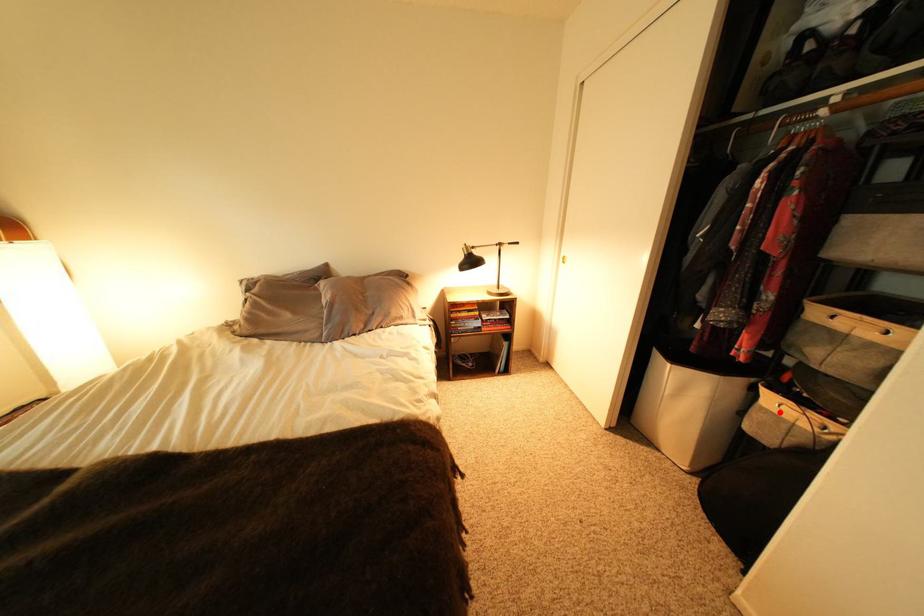
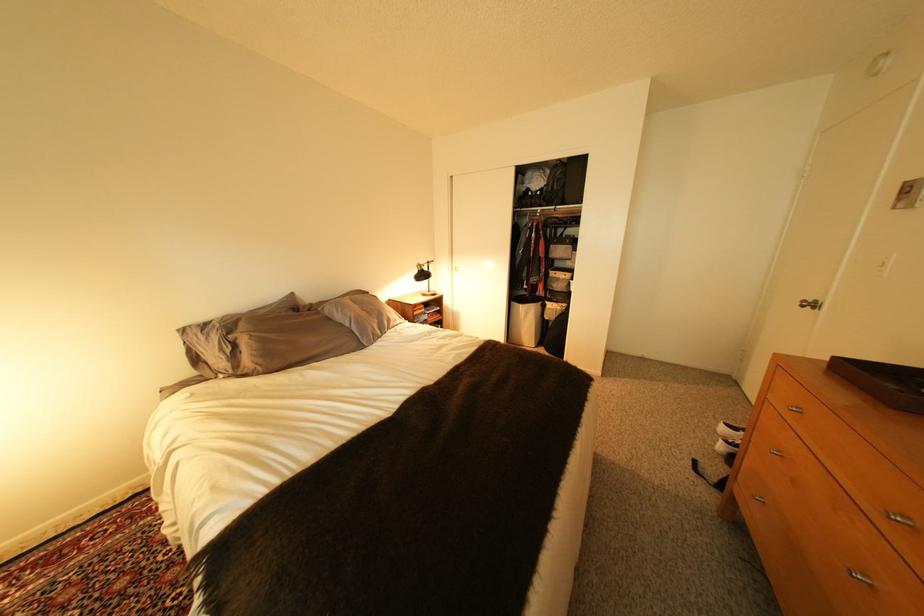
Question: I am providing you with two images of the same scene from different viewpoints. A red point is shown in image1. For the corresponding object point in image2, is it positioned nearer or farther from the camera?

Choices:
 (A) Nearer
 (B) Farther

Answer: (A)